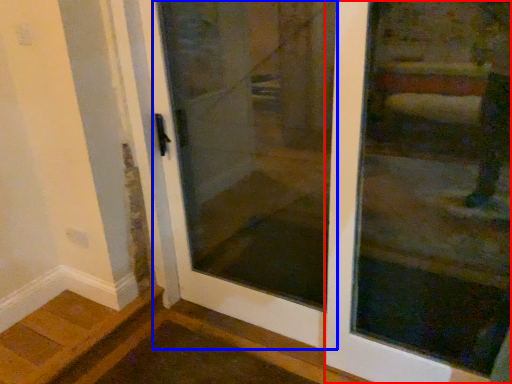
Question: Among these objects, which one is nearest to the camera, door (highlighted by a red box) or elevator door (highlighted by a blue box)?

Choices:
 (A) door
 (B) elevator door

Answer: (A)